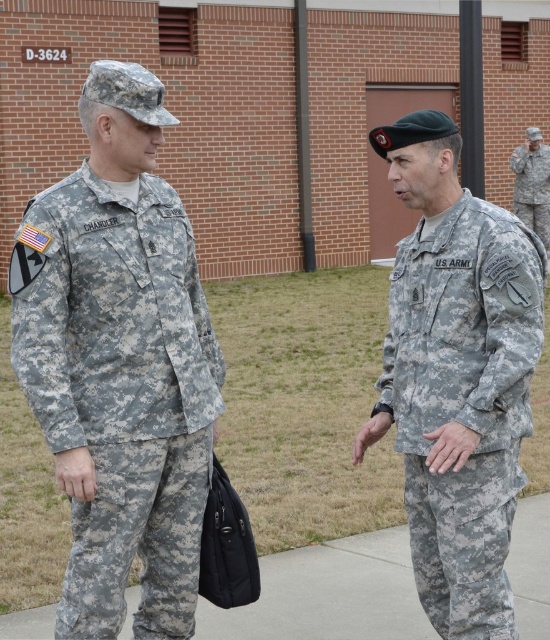
Between camouflage fabric uniform at left and camouflage fabric uniform at center, which one has more height?

camouflage fabric uniform at left

Is point (167, 204) more distant than point (405, 422)?

That is True.

This screenshot has width=550, height=640. What are the coordinates of `camouflage fabric uniform at left` in the screenshot? It's located at (122, 394).

Which is more to the left, gray concrete pavement at center or camouflage fabric uniform at right?

From the viewer's perspective, gray concrete pavement at center appears more on the left side.

Which is in front, point (301, 576) or point (519, 209)?

Point (301, 576)

Find the location of a particular element. gray concrete pavement at center is located at coordinates (328, 595).

Does camouflage fabric uniform at center appear under gray concrete pavement at center?

No.

Who is taller, camouflage fabric uniform at center or gray concrete pavement at center?

camouflage fabric uniform at center is taller.

Between point (510, 404) and point (321, 584), which one is positioned behind?

The point (321, 584) is more distant.

Image resolution: width=550 pixels, height=640 pixels. Find the location of `camouflage fabric uniform at center`. camouflage fabric uniform at center is located at coordinates (464, 403).